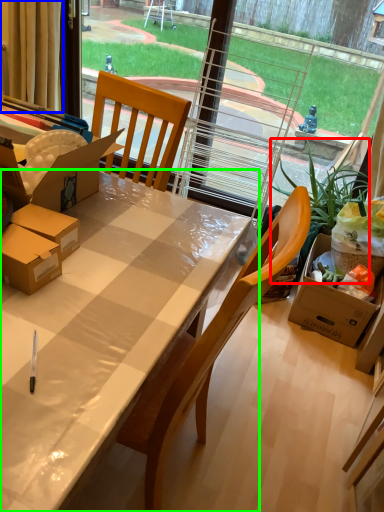
Question: Which is nearer to the houseplant (highlighted by a red box)? curtain (highlighted by a blue box) or desk (highlighted by a green box).

Choices:
 (A) curtain
 (B) desk

Answer: (B)